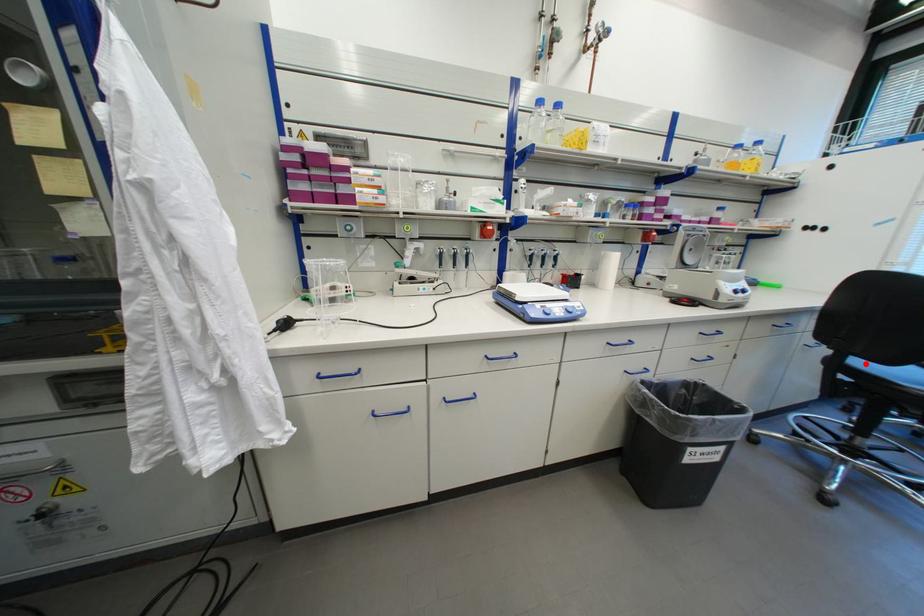
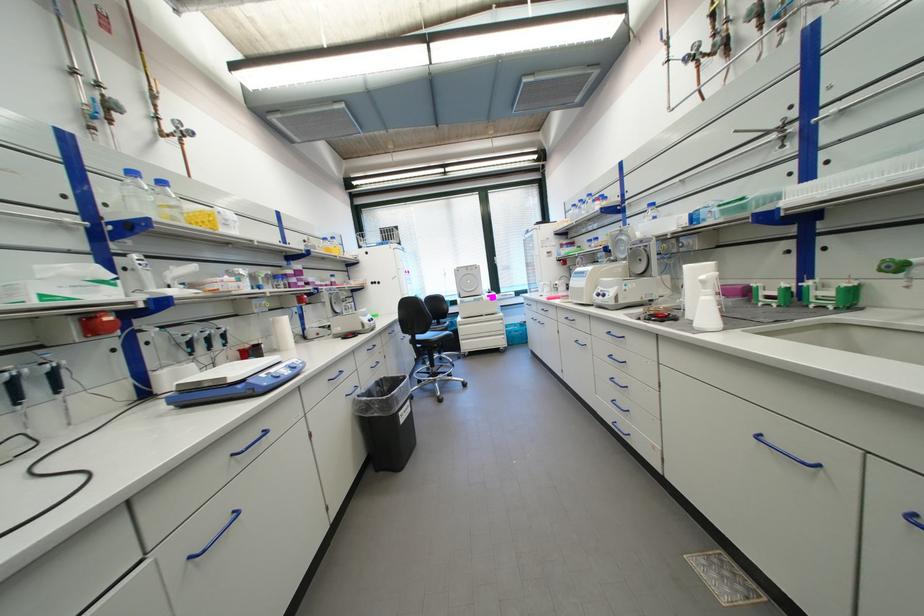
Locate, in the second image, the point that corresponds to the highlighted location in the first image.

(427, 338)